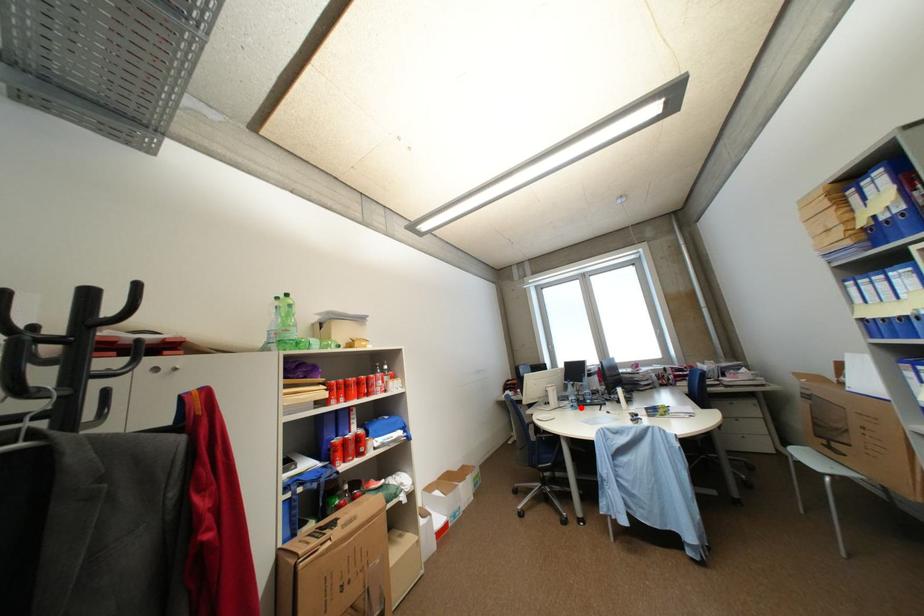
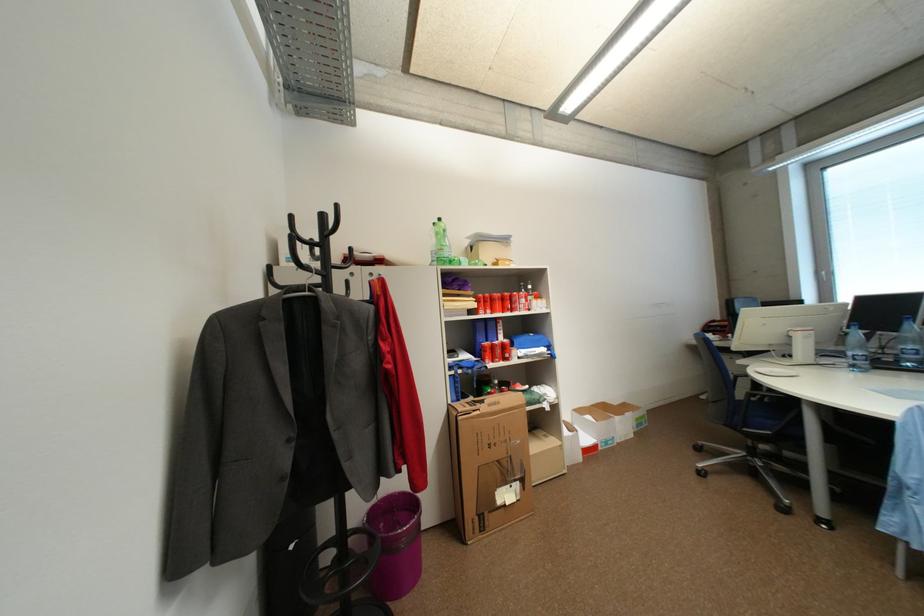
In the second image, find the point that corresponds to the highlighted location in the first image.

(861, 367)